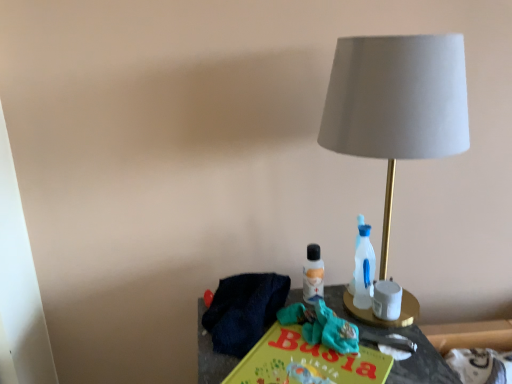
I want to click on blank space to the left of teal fabric scrub at center, so tap(245, 347).